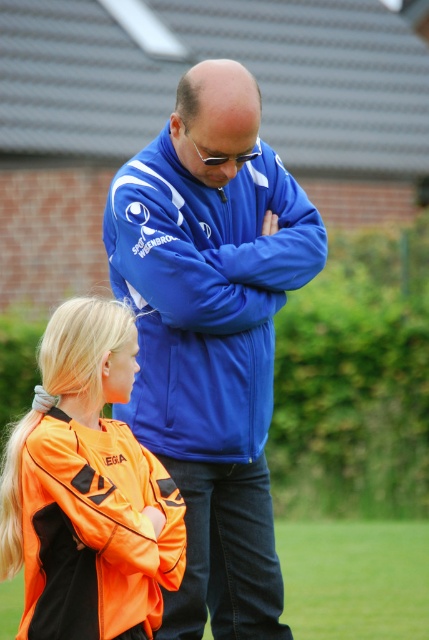
You are a photographer trying to capture both the blue softshell jacket at center and the green grass at lower center in a single shot. Which object should you focus on first to ensure both are in frame?

The blue softshell jacket at center is bigger than green grass at lower center, so you should focus on the blue softshell jacket at center first to ensure both are in frame.

You are a photographer trying to capture a candid shot of the two people in the scene. The blue softshell jacket at center is worn by the adult male. How far apart are the two individuals in the scene?

The two individuals are 21.52 feet apart.

You are a photographer trying to capture a clear shot of the green grass at lower center. However, the orange fabric jacket at lower left is blocking your view. Can you move the jacket to get an unobstructed view of the grass?

The orange fabric jacket at lower left is in front of green grass at lower center, so moving it would allow you to see the grass without obstruction.